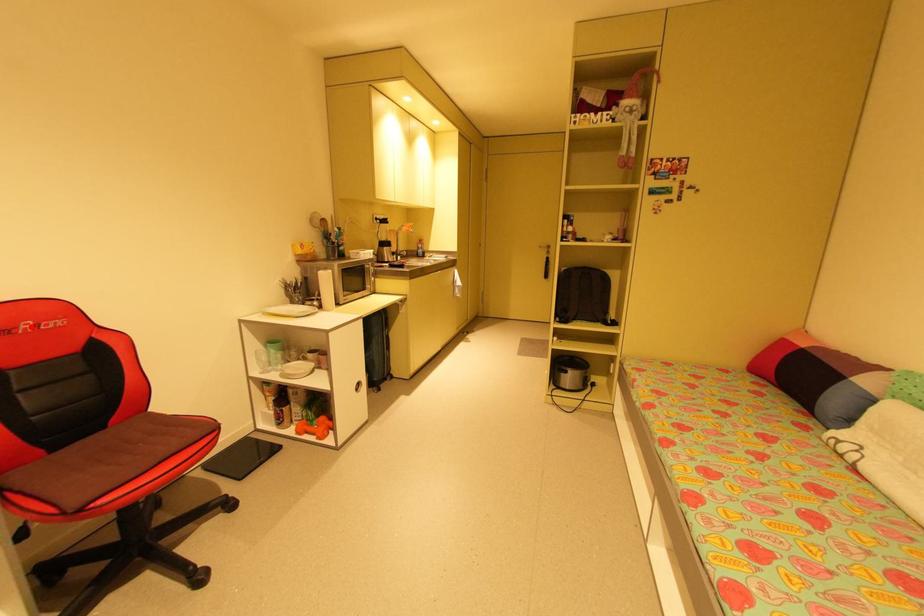
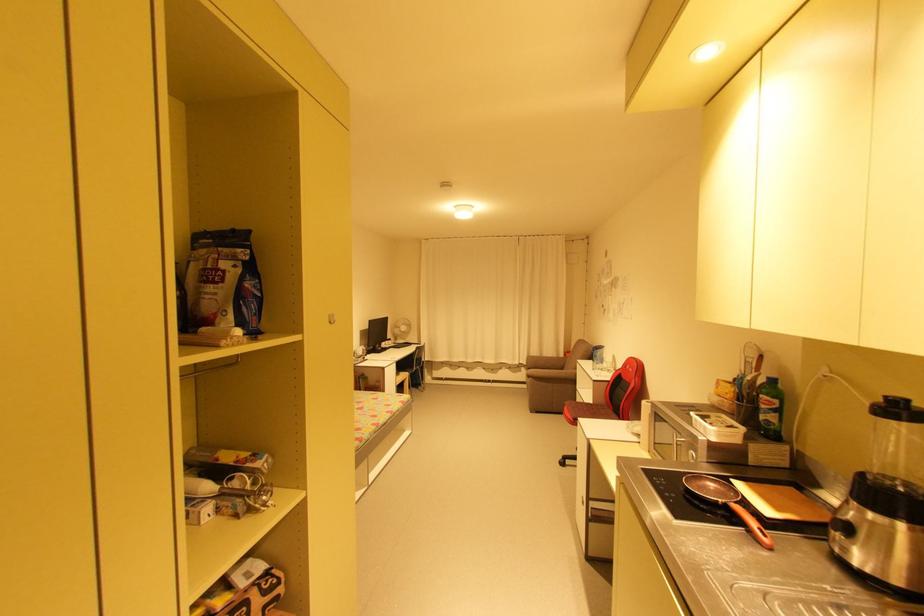
In the second image, find the point that corresponds to the highlighted location in the first image.

(631, 367)